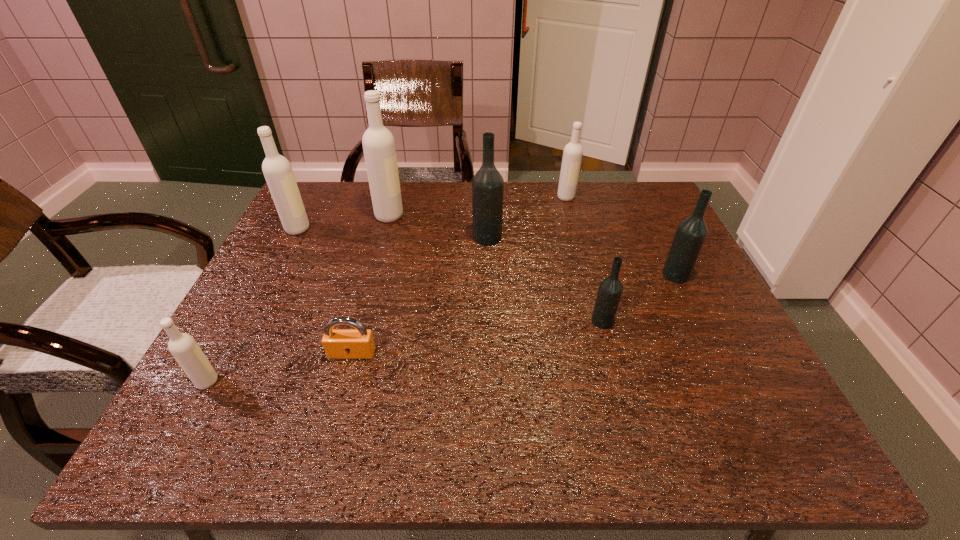
The image size is (960, 540). I want to click on vacant area between the fourth object from right to left and the rightmost white vodka, so click(x=527, y=217).

At what (x,y) coordinates should I click in order to perform the action: click on free space between the nearest vodka and the sixth farthest vodka. Please return your answer as a coordinate pair (x, y). The image size is (960, 540). Looking at the image, I should click on (405, 352).

What are the coordinates of `vacant area that lies between the second nearest vodka and the second biggest white vodka` in the screenshot? It's located at (449, 275).

Where is `free spot between the third smallest white vodka and the smallest black vodka`? free spot between the third smallest white vodka and the smallest black vodka is located at coordinates (449, 275).

Identify the location of free space between the nearest object and the rightmost white vodka. (387, 289).

Locate an element on the screen. Image resolution: width=960 pixels, height=540 pixels. vacant space that's between the fourth vodka from right to left and the farthest vodka is located at coordinates (527, 217).

At what (x,y) coordinates should I click in order to perform the action: click on empty space between the fifth vodka from right to left and the second biggest white vodka. Please return your answer as a coordinate pair (x, y). The width and height of the screenshot is (960, 540). Looking at the image, I should click on (344, 222).

The width and height of the screenshot is (960, 540). Find the location of `vacant space that is in between the nearest white vodka and the shortest object`. vacant space that is in between the nearest white vodka and the shortest object is located at coordinates (279, 368).

You are a GUI agent. You are given a task and a screenshot of the screen. Output one action in this format:
    pyautogui.click(x=<x>, y=<y>)
    Task: Click on the vacant space in between the second biggest white vodka and the padlock
    
    Given the screenshot: What is the action you would take?
    pyautogui.click(x=324, y=291)

Locate an element on the screen. The image size is (960, 540). vacant point located between the leftmost black vodka and the second farthest black vodka is located at coordinates (582, 256).